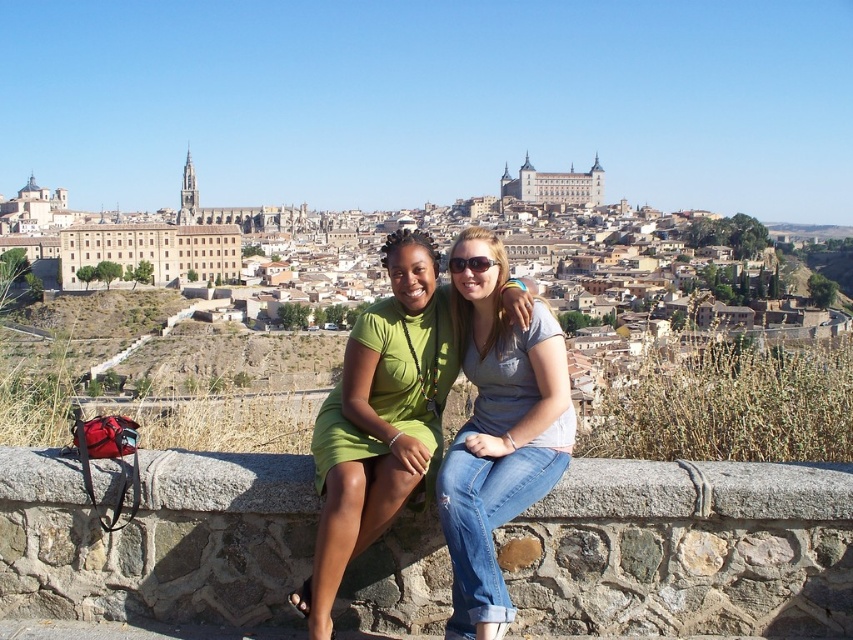
Question: Can you confirm if green matte dress at center is positioned to the right of denim jeans at center?

Choices:
 (A) yes
 (B) no

Answer: (B)

Question: Which of the following is the farthest from the observer?

Choices:
 (A) stone ledge at center
 (B) denim jeans at center
 (C) green matte dress at center

Answer: (C)

Question: Can you confirm if stone ledge at center is positioned below green matte dress at center?

Choices:
 (A) no
 (B) yes

Answer: (B)

Question: Which point appears farthest from the camera in this image?

Choices:
 (A) (479, 524)
 (B) (517, 314)
 (C) (15, 456)

Answer: (B)

Question: Is green matte dress at center wider than denim jeans at center?

Choices:
 (A) yes
 (B) no

Answer: (A)

Question: Which point is farther to the camera?

Choices:
 (A) green matte dress at center
 (B) stone ledge at center

Answer: (A)